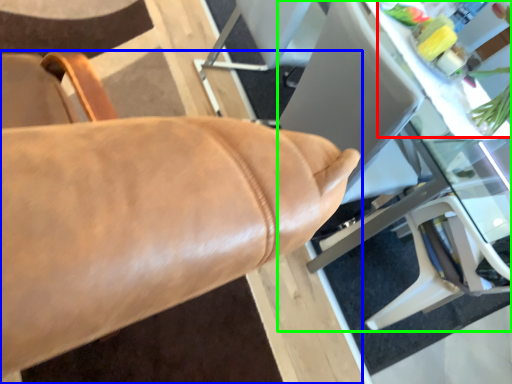
Question: Which object is positioned farthest from floral arrangement (highlighted by a red box)? Select from chair (highlighted by a blue box) and table (highlighted by a green box).

Choices:
 (A) chair
 (B) table

Answer: (A)